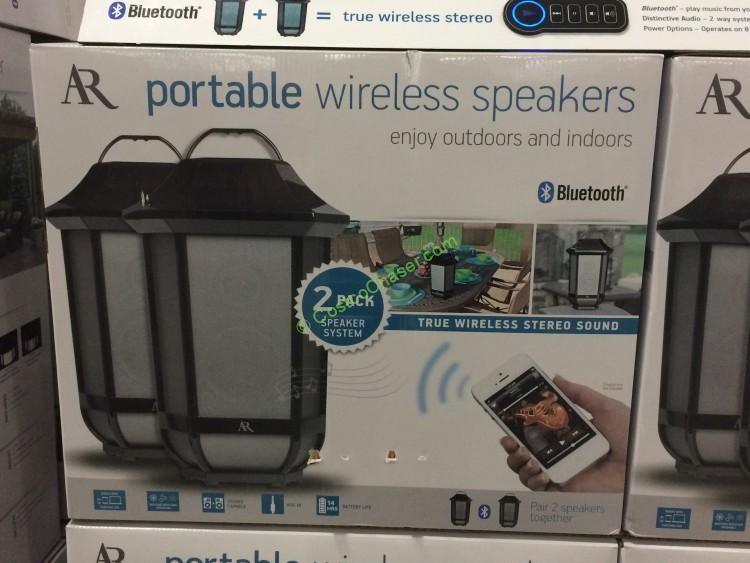
At what (x,y) coordinates should I click in order to perform the action: click on speaker. Please return your answer as a coordinate pair (x, y). Looking at the image, I should click on (124, 281), (208, 272), (445, 275), (577, 263), (709, 265), (226, 15), (294, 17), (460, 511), (504, 512).